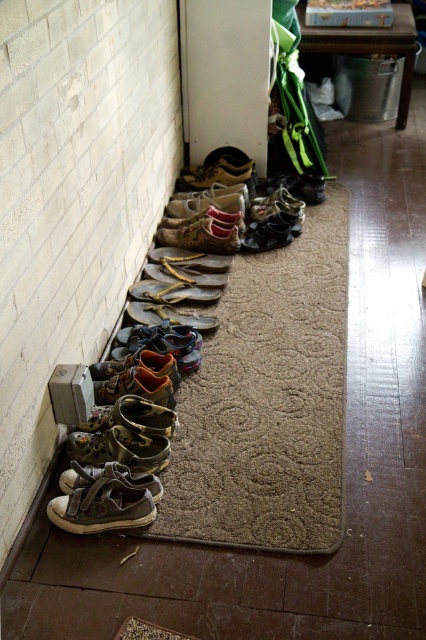
Does brown suede shoe at lower center appear under brown leather shoe at lower center?

No.

Find the location of a particular element. brown suede shoe at lower center is located at coordinates (216, 170).

Locate an element on the screen. Image resolution: width=426 pixels, height=640 pixels. brown suede shoe at lower center is located at coordinates (216, 170).

Is brown textured doormat at lower left closer to camera compared to leather shoe at lower left?

Yes.

Can you confirm if brown textured doormat at lower left is wider than leather shoe at lower left?

Indeed, brown textured doormat at lower left has a greater width compared to leather shoe at lower left.

The height and width of the screenshot is (640, 426). Find the location of `brown textured doormat at lower left`. brown textured doormat at lower left is located at coordinates (267, 403).

Does leather shoe at lower left have a greater width compared to matte black shoe at center?

Indeed, leather shoe at lower left has a greater width compared to matte black shoe at center.

From the picture: Is leather shoe at lower left below matte black shoe at center?

Yes.

Is point (135, 392) positioned behind point (258, 250)?

No.

Where is `leather shoe at lower left`? This screenshot has height=640, width=426. leather shoe at lower left is located at coordinates (135, 387).